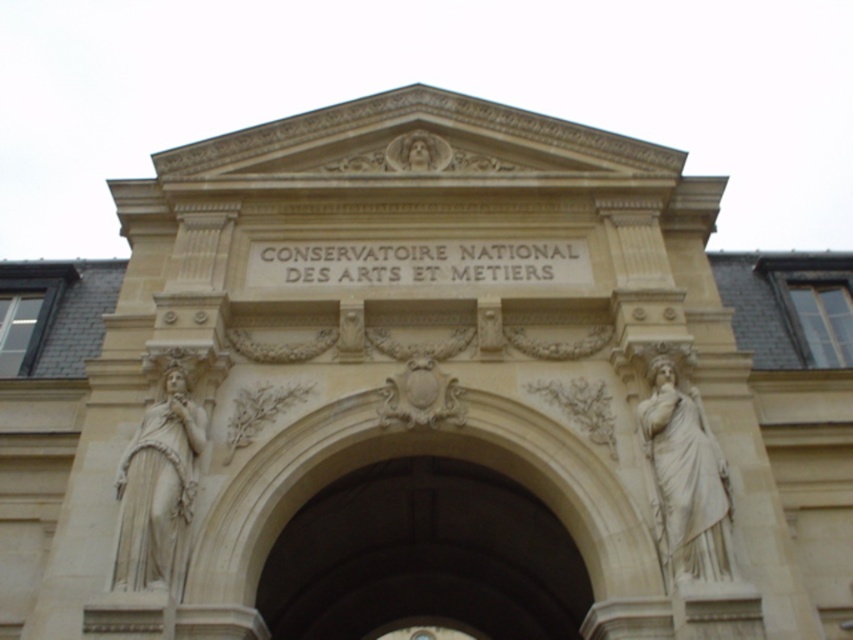
Is white marble statue at right below white stone statue at left?

No, white marble statue at right is not below white stone statue at left.

Is point (727, 472) positioned behind point (152, 404)?

No, it is not.

Find the location of a particular element. The width and height of the screenshot is (853, 640). white marble statue at right is located at coordinates (683, 480).